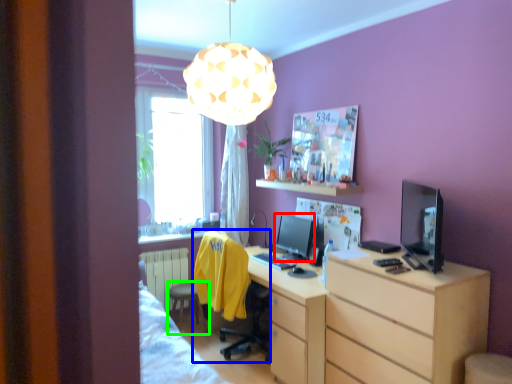
Question: Which object is positioned farthest from computer monitor (highlighted by a red box)? Select from swivel chair (highlighted by a blue box) and stool (highlighted by a green box).

Choices:
 (A) swivel chair
 (B) stool

Answer: (B)